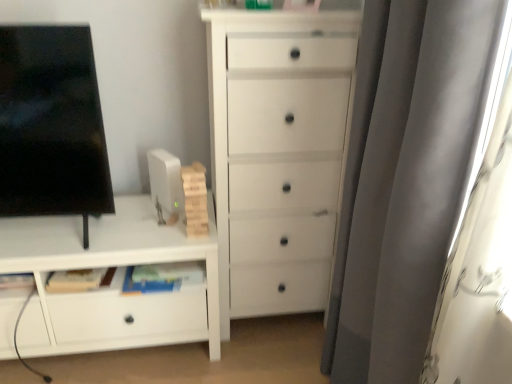
Question: Is black glossy screen at left smaller than white matte chest of drawers at center, the 1th chest of drawers from the right?

Choices:
 (A) yes
 (B) no

Answer: (A)

Question: Is black glossy screen at left not within white matte chest of drawers at center, which is the 2th chest of drawers from left to right?

Choices:
 (A) yes
 (B) no

Answer: (A)

Question: Is black glossy screen at left taller than white matte chest of drawers at center, which is the 2th chest of drawers from left to right?

Choices:
 (A) no
 (B) yes

Answer: (A)

Question: From a real-world perspective, does black glossy screen at left sit lower than white matte chest of drawers at center, the 1th chest of drawers from the right?

Choices:
 (A) no
 (B) yes

Answer: (A)

Question: Could white matte chest of drawers at center, the 1th chest of drawers from the right, be considered to be inside black glossy screen at left?

Choices:
 (A) yes
 (B) no

Answer: (B)

Question: From the image's perspective, is black glossy screen at left over white matte chest of drawers at center, the 1th chest of drawers from the right?

Choices:
 (A) yes
 (B) no

Answer: (A)

Question: Can you confirm if white matte chest of drawers at center, the 1th chest of drawers from the right, is positioned to the right of black glossy screen at left?

Choices:
 (A) no
 (B) yes

Answer: (B)

Question: From the image's perspective, is white matte chest of drawers at center, which is the 2th chest of drawers from left to right, above black glossy screen at left?

Choices:
 (A) no
 (B) yes

Answer: (A)

Question: Is white matte chest of drawers at center, the 1th chest of drawers from the right, completely or partially outside of black glossy screen at left?

Choices:
 (A) yes
 (B) no

Answer: (A)

Question: Is there a large distance between white matte chest of drawers at center, which is the 2th chest of drawers from left to right, and black glossy screen at left?

Choices:
 (A) yes
 (B) no

Answer: (B)

Question: Is white matte chest of drawers at center, which is the 2th chest of drawers from left to right, oriented away from black glossy screen at left?

Choices:
 (A) no
 (B) yes

Answer: (A)

Question: Are white matte chest of drawers at center, which is the 2th chest of drawers from left to right, and black glossy screen at left beside each other?

Choices:
 (A) yes
 (B) no

Answer: (B)

Question: Is white matte cabinet at lower left, which ranks as the 1th chest of drawers in left-to-right order, at the back of black glossy screen at left?

Choices:
 (A) no
 (B) yes

Answer: (A)